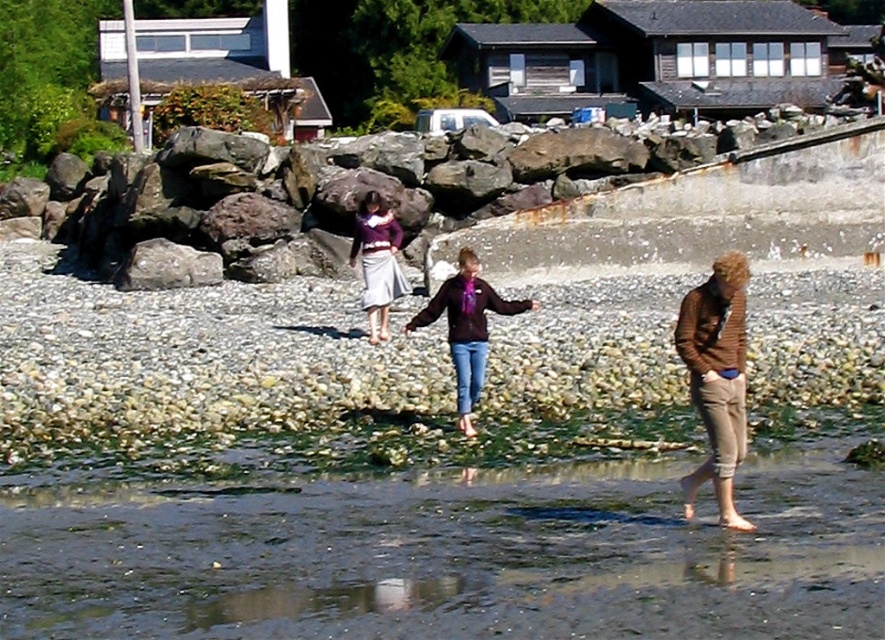
Based on the photo, you are standing on the beach in the image and want to walk to both the point at coordinates point (689, 500) and point (152, 268). Which point should you reach first if you want to visit the closer one first?

You should reach point (689, 500) first because it is closer to you than point (152, 268).